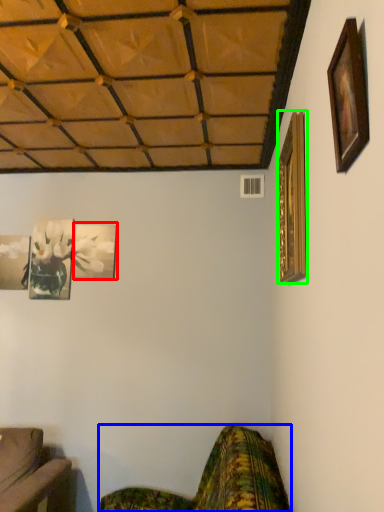
Question: Which is nearer to the picture frame (highlighted by a red box)? studio couch (highlighted by a blue box) or picture frame (highlighted by a green box).

Choices:
 (A) studio couch
 (B) picture frame

Answer: (A)